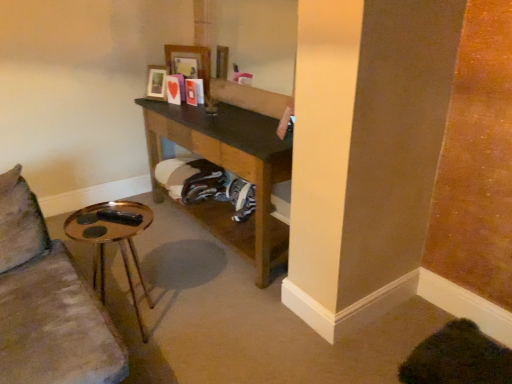
At what (x,y) coordinates should I click in order to perform the action: click on free location in front of wooden photo frame at upper center, the 2th picture frame from the right. Please return your answer as a coordinate pair (x, y). This screenshot has width=512, height=384. Looking at the image, I should click on (161, 104).